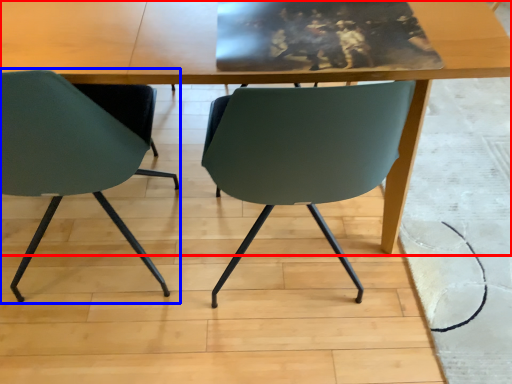
Question: Which point is further to the camera, table (highlighted by a red box) or chair (highlighted by a blue box)?

Choices:
 (A) table
 (B) chair

Answer: (A)